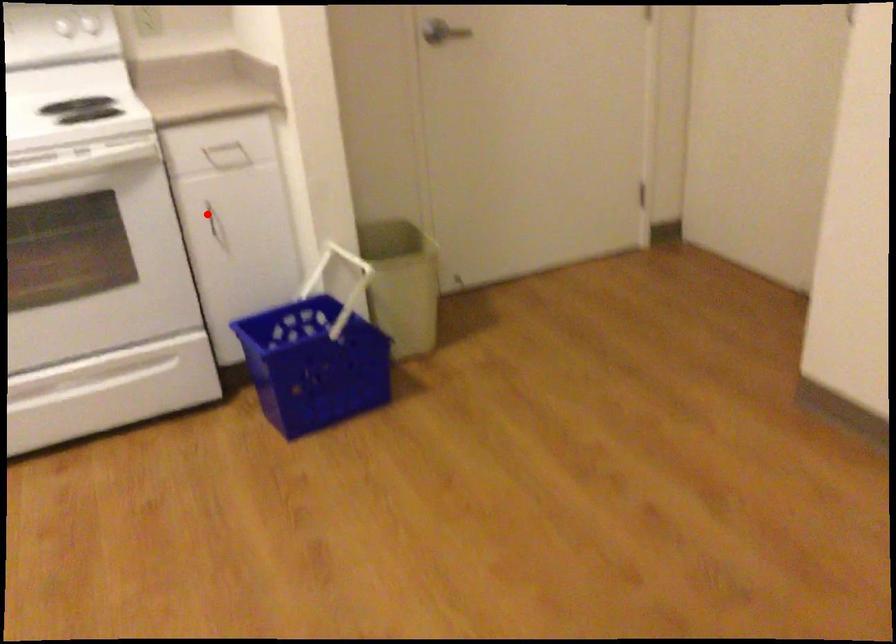
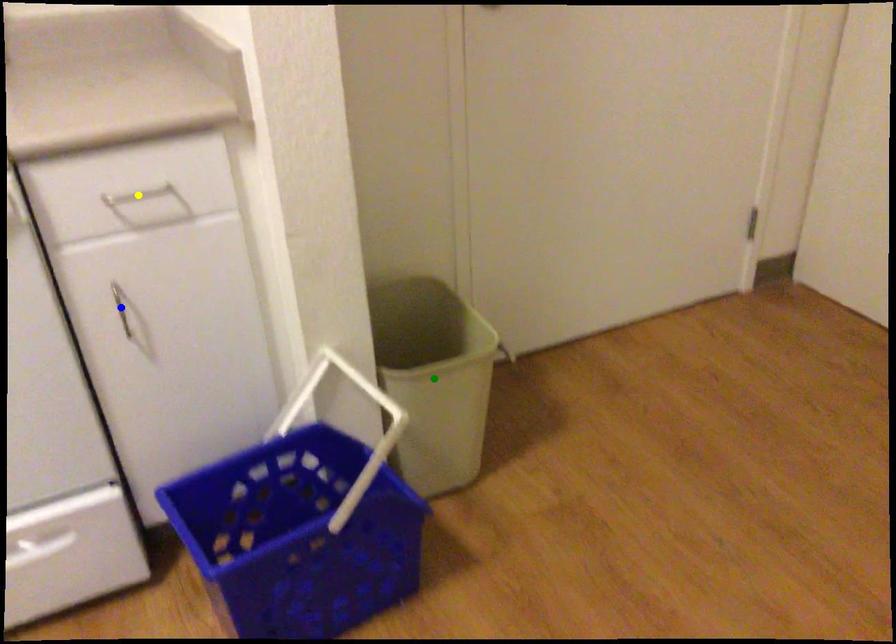
Question: I am providing you with two images of the same scene from different viewpoints. A red point is marked on the first image. You are given multiple points on the second image. Which mark in image 2 goes with the point in image 1?

Choices:
 (A) blue point
 (B) green point
 (C) yellow point

Answer: (A)